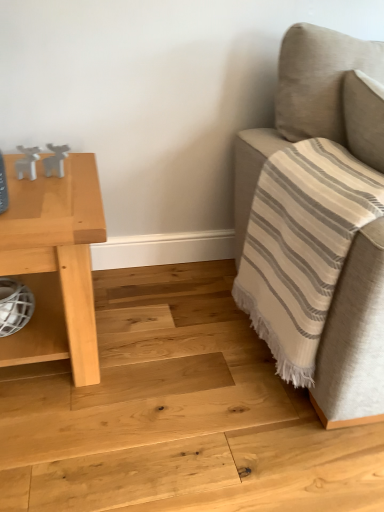
Identify the location of free space above light wood table at left (from a real-world perspective). This screenshot has height=512, width=384. (38, 197).